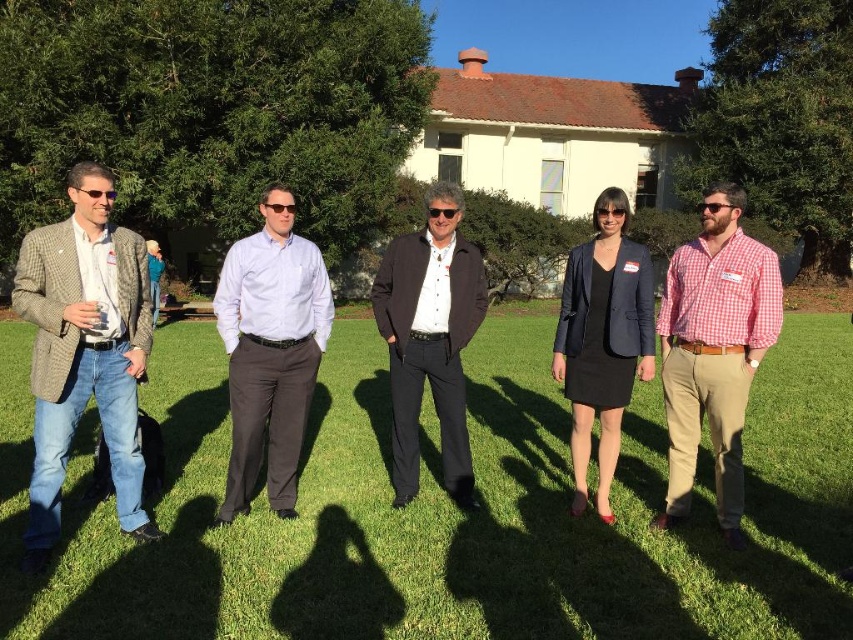
You are standing in the group photo and want to locate the navy blue fabric business suit at center and the glossy plastic sunglasses at center. Which one is positioned to the right of the other?

The navy blue fabric business suit at center is to the right of the glossy plastic sunglasses at center.

You are standing at the origin point of the coordinate system. You want to walk to the red checkered shirt at center. What direction should you move in?

The red checkered shirt at center is located at coordinate point 0.548 on the x axis and 0.838 on the y axis. Since the origin is at the bottom left corner, moving towards increasing x and y values would mean moving to the right and upwards. Therefore, you should move to the right and upwards to reach the red checkered shirt at center.

You are standing on the grassy lawn and want to hand a document to both the plaid wool blazer at left and the navy blue fabric business suit at center. Which person should you approach first to ensure you can reach them without moving closer to the white building with a red roof?

You should approach the plaid wool blazer at left first because they are closer to you than the navy blue fabric business suit at center, so you can reach them without moving closer to the white building with a red roof.